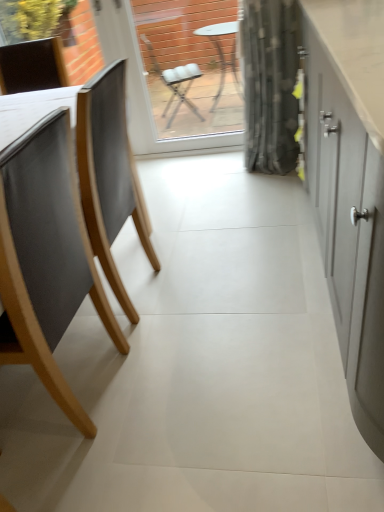
This screenshot has height=512, width=384. Identify the location of vacant area that is in front of transparent glass window screen at center. (208, 182).